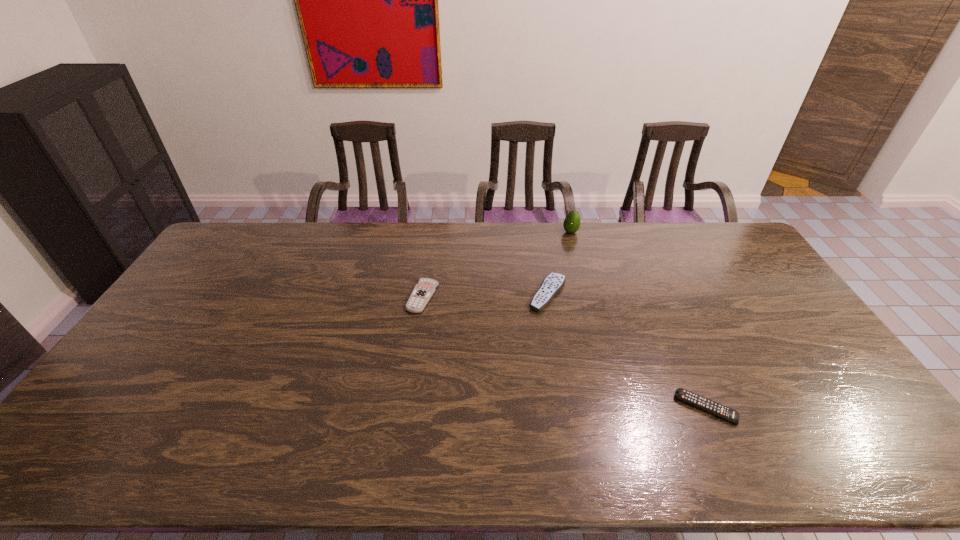
Identify which remote control is the closest to the tallest remote control. Please provide its 2D coordinates. Your answer should be formatted as a tuple, i.e. [(x, y)], where the tuple contains the x and y coordinates of a point satisfying the conditions above.

[(423, 291)]

Identify the location of free location that satisfies the following two spatial constraints: 1. on the back side of the leftmost object; 2. on the left side of the farthest object. The image size is (960, 540). (432, 232).

This screenshot has width=960, height=540. I want to click on free space that satisfies the following two spatial constraints: 1. on the front side of the rightmost remote control; 2. on the left side of the third shortest object, so click(x=567, y=408).

Identify the location of blank space that satisfies the following two spatial constraints: 1. on the back side of the leftmost object; 2. on the left side of the tallest remote control. This screenshot has width=960, height=540. (423, 294).

Find the location of a particular element. The height and width of the screenshot is (540, 960). vacant region that satisfies the following two spatial constraints: 1. on the front side of the second object from right to left; 2. on the right side of the nearest object is located at coordinates (617, 408).